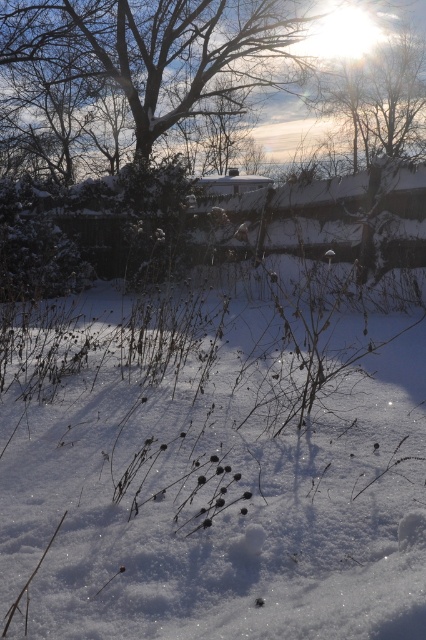
Question: Does white fluffy snow at center have a lesser width compared to bare branches at upper center?

Choices:
 (A) yes
 (B) no

Answer: (A)

Question: Which point is farther from the camera taking this photo?

Choices:
 (A) (54, 45)
 (B) (304, 376)

Answer: (A)

Question: Is white fluffy snow at center smaller than bare branches at upper center?

Choices:
 (A) yes
 (B) no

Answer: (A)

Question: Observing the image, what is the correct spatial positioning of white fluffy snow at center in reference to bare branches at upper center?

Choices:
 (A) right
 (B) left

Answer: (A)